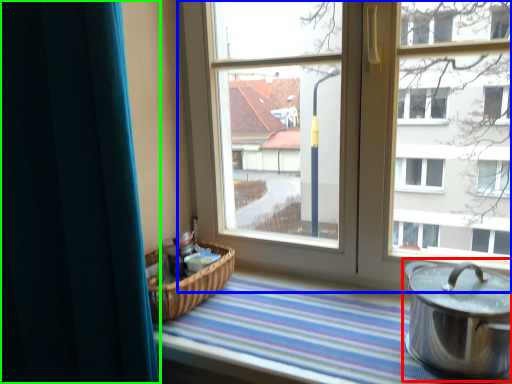
Question: Considering the real-world distances, which object is closest to crock pot (highlighted by a red box)? window (highlighted by a blue box) or curtain (highlighted by a green box).

Choices:
 (A) window
 (B) curtain

Answer: (A)